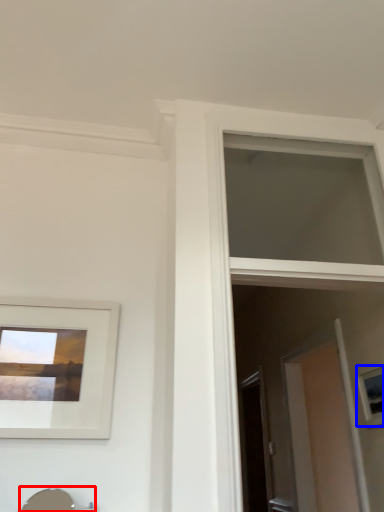
Question: Which object appears closest to the camera in this image, sink (highlighted by a red box) or picture frame (highlighted by a blue box)?

Choices:
 (A) sink
 (B) picture frame

Answer: (A)